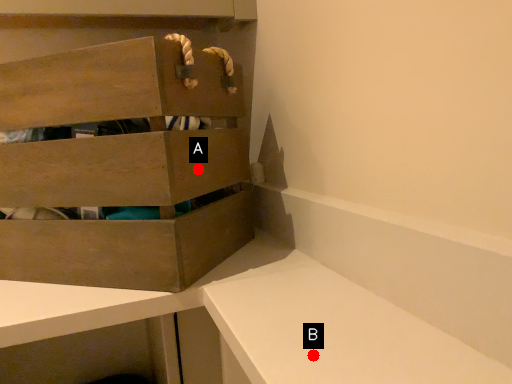
Question: Two points are circled on the image, labeled by A and B beside each circle. Which of the following is the closest to the observer?

Choices:
 (A) A is closer
 (B) B is closer

Answer: (B)